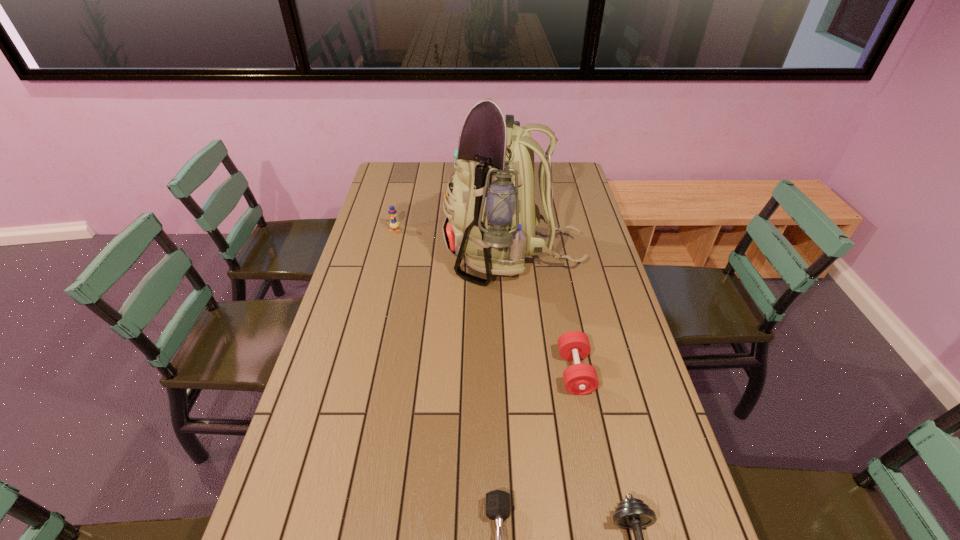
The image size is (960, 540). What are the coordinates of `backpack at the right edge` in the screenshot? It's located at (491, 215).

The width and height of the screenshot is (960, 540). I want to click on dumbbell that is positioned at the right edge, so click(x=579, y=379).

Locate an element on the screen. The height and width of the screenshot is (540, 960). free spot at the left edge of the desktop is located at coordinates (332, 501).

In the image, there is a desktop. What are the coordinates of `vacant space at the right edge` in the screenshot? It's located at (573, 269).

At what (x,y) coordinates should I click in order to perform the action: click on vacant point located between the farthest dumbbell and the tallest object. Please return your answer as a coordinate pair (x, y). This screenshot has width=960, height=540. Looking at the image, I should click on (544, 314).

In order to click on empty space between the farthest dumbbell and the duckling in this screenshot , I will do `click(485, 301)`.

Find the location of a particular element. The image size is (960, 540). free spot between the duckling and the farthest dumbbell is located at coordinates 485,301.

Where is `object that is the third closest to the second tallest object`? The height and width of the screenshot is (540, 960). object that is the third closest to the second tallest object is located at coordinates (498, 508).

Where is `object that ranks as the fourth closest to the shortest object`? The height and width of the screenshot is (540, 960). object that ranks as the fourth closest to the shortest object is located at coordinates (394, 224).

Locate an element on the screen. The height and width of the screenshot is (540, 960). dumbbell object that ranks as the second closest to the leftmost dumbbell is located at coordinates (579, 379).